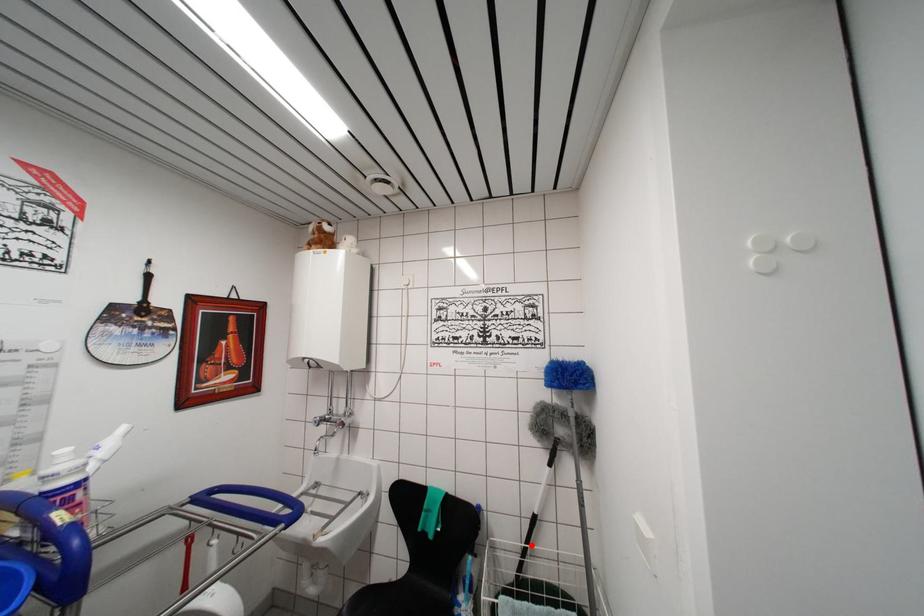
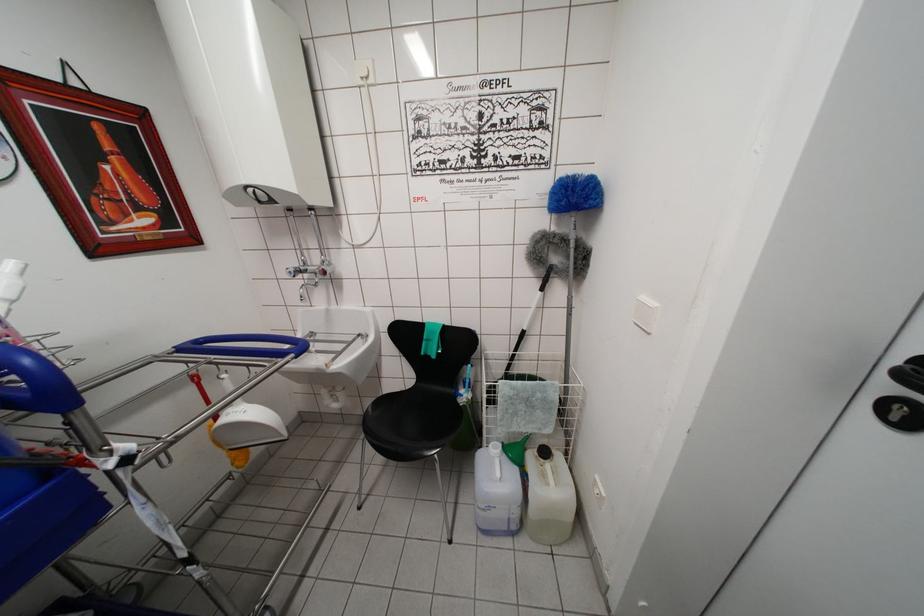
The point at the highlighted location is marked in the first image. Where is the corresponding point in the second image?

(518, 354)